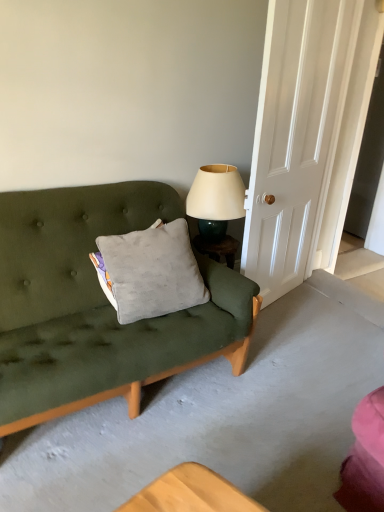
Question: Looking at their shapes, would you say gray velvety pillow at center is wider or thinner than matte cream lampshade at upper right?

Choices:
 (A) thin
 (B) wide

Answer: (A)

Question: Looking at the image, does gray velvety pillow at center seem bigger or smaller compared to matte cream lampshade at upper right?

Choices:
 (A) big
 (B) small

Answer: (A)

Question: Estimate the real-world distances between objects in this image. Which object is farther from the white wood door at right?

Choices:
 (A) gray velvety pillow at center
 (B) matte cream lampshade at upper right

Answer: (A)

Question: Which is farther from the gray velvety pillow at center?

Choices:
 (A) matte cream lampshade at upper right
 (B) white wood door at right

Answer: (B)